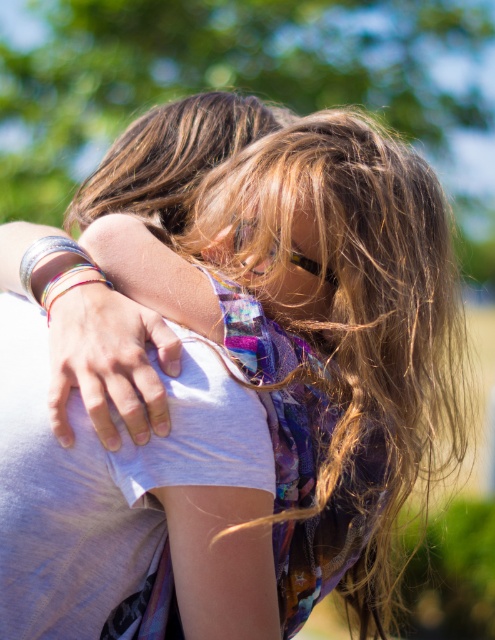
Can you confirm if brown shiny hair at upper center is positioned to the right of clear plastic goggles at center?

No, brown shiny hair at upper center is not to the right of clear plastic goggles at center.

This screenshot has height=640, width=495. I want to click on brown shiny hair at upper center, so click(169, 157).

Which is behind, point (198, 182) or point (266, 262)?

Point (198, 182)

This screenshot has width=495, height=640. I want to click on brown shiny hair at upper center, so pos(169,157).

Can you confirm if metallic silver bracelet at upper left is positioned to the right of brown shiny hair at upper center?

In fact, metallic silver bracelet at upper left is to the left of brown shiny hair at upper center.

Can you confirm if metallic silver bracelet at upper left is smaller than brown shiny hair at upper center?

Yes, metallic silver bracelet at upper left is smaller than brown shiny hair at upper center.

Which is behind, point (137, 378) or point (236, 129)?

Point (236, 129)

Image resolution: width=495 pixels, height=640 pixels. Identify the location of metallic silver bracelet at upper left. (109, 364).

Who is lower down, metallic silver bracelet at upper left or clear plastic goggles at center?

Positioned lower is metallic silver bracelet at upper left.

From the picture: Can you confirm if metallic silver bracelet at upper left is thinner than clear plastic goggles at center?

No, metallic silver bracelet at upper left is not thinner than clear plastic goggles at center.

The width and height of the screenshot is (495, 640). Find the location of `metallic silver bracelet at upper left`. metallic silver bracelet at upper left is located at coordinates (109, 364).